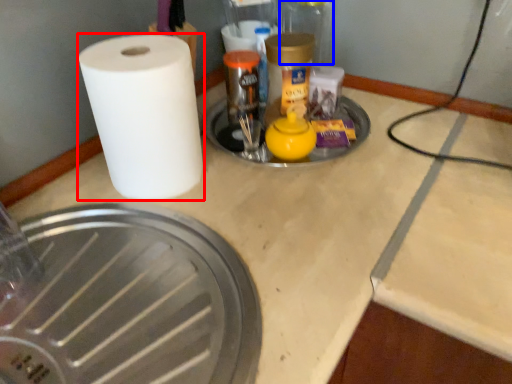
Question: Which object is closer to the camera taking this photo, paper towel (highlighted by a red box) or glass jar (highlighted by a blue box)?

Choices:
 (A) paper towel
 (B) glass jar

Answer: (A)